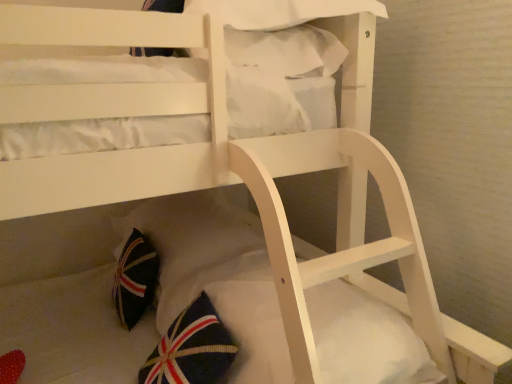
Question: In the image, is white soft mattress at lower center positioned in front of or behind dark blue fabric pillow at lower center, the first pillow ordered from the bottom?

Choices:
 (A) front
 (B) behind

Answer: (A)

Question: Considering the positions of white soft mattress at lower center and dark blue fabric pillow at lower center, the first pillow ordered from the bottom, in the image, is white soft mattress at lower center bigger or smaller than dark blue fabric pillow at lower center, the first pillow ordered from the bottom,?

Choices:
 (A) small
 (B) big

Answer: (A)

Question: Estimate the real-world distances between objects in this image. Which object is farther from the white soft mattress at lower center?

Choices:
 (A) white fabric pillow at upper center, the 1th pillow positioned from the top
 (B) dark blue fabric pillow at lower center, which appears as the second pillow when viewed from the top

Answer: (A)

Question: Which object is the closest to the white fabric pillow at upper center, which is counted as the 2th pillow, starting from the bottom?

Choices:
 (A) white soft mattress at lower center
 (B) dark blue fabric pillow at lower center, which appears as the second pillow when viewed from the top

Answer: (B)